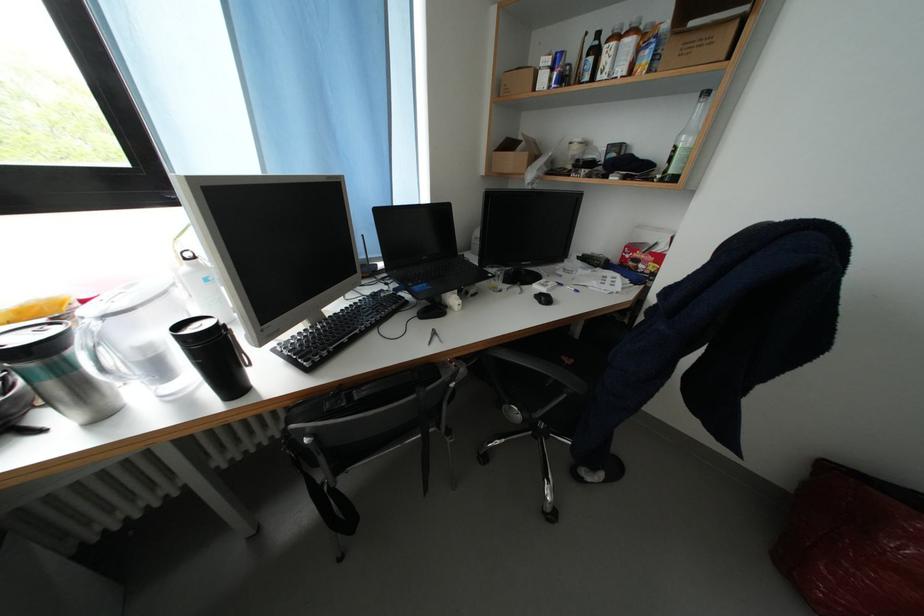
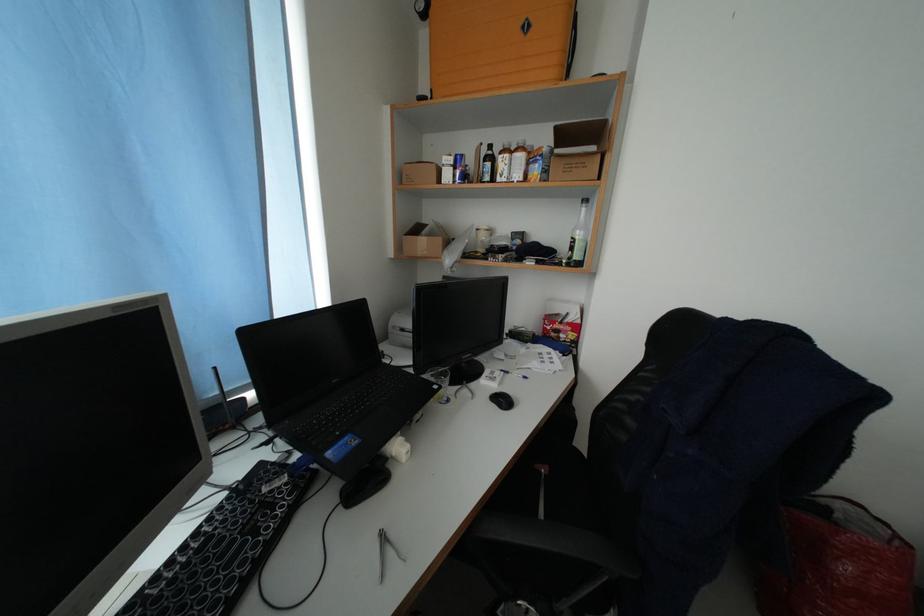
Where in the second image is the point corresponding to (x=525, y=294) from the first image?

(473, 397)